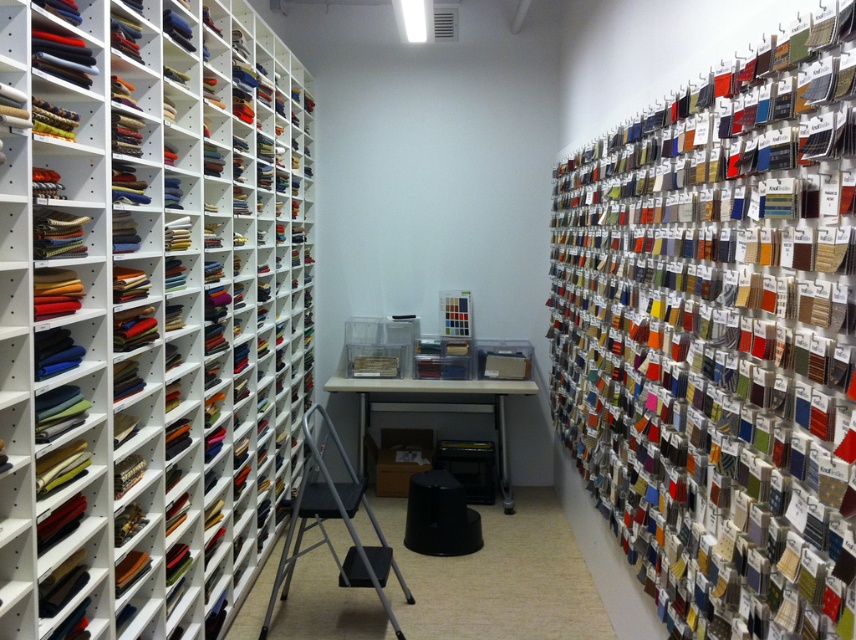
You are standing in the storage room and want to reach both points mentioned. Which point, point [788,593] or point [426,552], is closer to you?

Point [788,593] is closer to the viewer than point [426,552].

You are organizing fabric samples in the storage room. You need to place a large roll of fabric that requires 2 meters of shelf space. Which object from the matte fabric bookshelf at left and the matte plastic bookshelf at right can accommodate this requirement?

The matte fabric bookshelf at left is larger in size than the matte plastic bookshelf at right, so it can accommodate the large roll of fabric requiring 2 meters of shelf space.

You are a tailor standing 1.2 meters away from the camera in the storage room. You need to reach the matte fabric bookshelf at left to pick up some fabric samples. Can you comfortably reach the shelf without moving closer?

The matte fabric bookshelf at left is 1.51 meters away from the camera. Since you are standing 1.2 meters away from the camera, the total distance between you and the shelf is 0.31 meters. This distance is too short, so you can comfortably reach the shelf without needing to move closer.